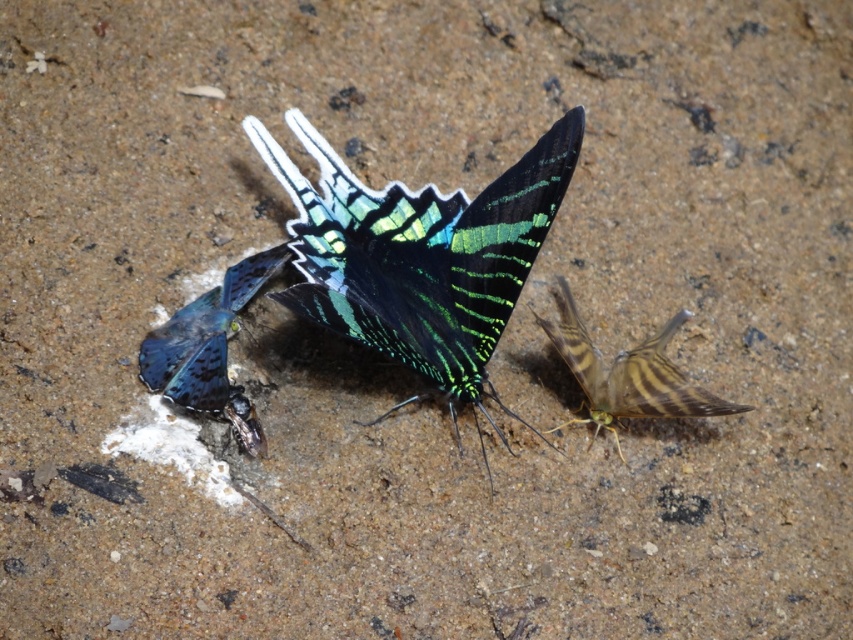
Is shiny metallic butterfly at center above shiny blue butterfly at left?

Yes, shiny metallic butterfly at center is above shiny blue butterfly at left.

Measure the distance between point (525, 157) and camera.

Point (525, 157) and camera are 4.59 feet apart.

Does point (461, 358) come farther from viewer compared to point (263, 268)?

No, (461, 358) is in front of (263, 268).

The image size is (853, 640). In order to click on shiny metallic butterfly at center in this screenshot , I will do `click(421, 257)`.

Is point (193, 328) less distant than point (254, 438)?

No, it is behind (254, 438).

Who is positioned more to the right, shiny blue butterfly at left or shiny metallic insect at center?

shiny metallic insect at center is more to the right.

Does point (262, 260) come behind point (231, 429)?

Yes, point (262, 260) is farther from viewer.

This screenshot has height=640, width=853. Identify the location of shiny blue butterfly at left. (210, 349).

Is shiny metallic butterfly at center further to the viewer compared to brown striped butterfly at right?

No, shiny metallic butterfly at center is closer to the viewer.

Is point (293, 200) farther from camera compared to point (561, 349)?

Yes, it is.

Locate an element on the screen. This screenshot has height=640, width=853. shiny metallic butterfly at center is located at coordinates (421, 257).